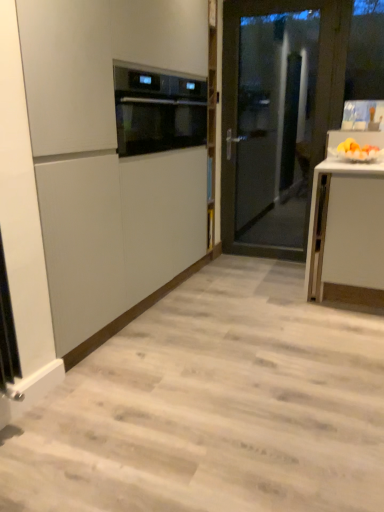
Question: In terms of height, does satin black oven at upper center look taller or shorter compared to yellow matte fruit at right?

Choices:
 (A) tall
 (B) short

Answer: (A)

Question: Based on their sizes in the image, would you say satin black oven at upper center is bigger or smaller than yellow matte fruit at right?

Choices:
 (A) small
 (B) big

Answer: (B)

Question: Which of these objects is positioned farthest from the transparent glass door at center?

Choices:
 (A) matte white cabinet at center
 (B) satin black oven at upper center
 (C) yellow matte fruit at right

Answer: (A)

Question: Estimate the real-world distances between objects in this image. Which object is farther from the yellow matte fruit at right?

Choices:
 (A) transparent glass door at center
 (B) satin black oven at upper center
 (C) matte white cabinet at center

Answer: (C)